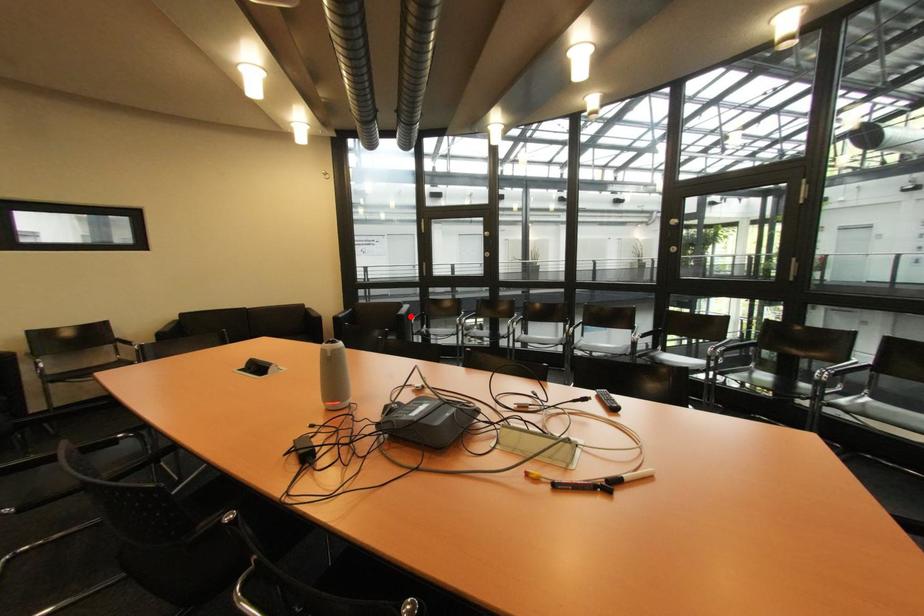
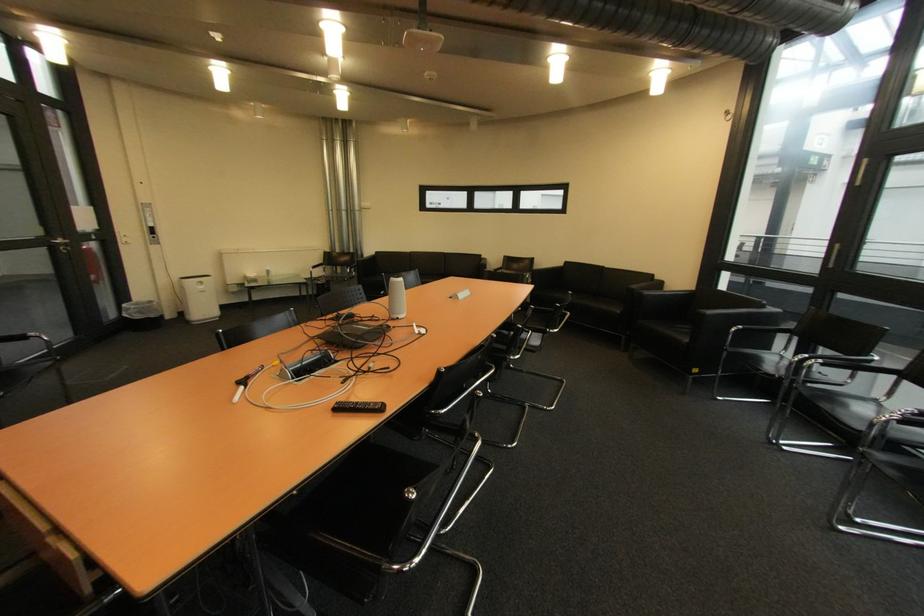
In the second image, find the point that corresponds to the highlighted location in the first image.

(712, 315)